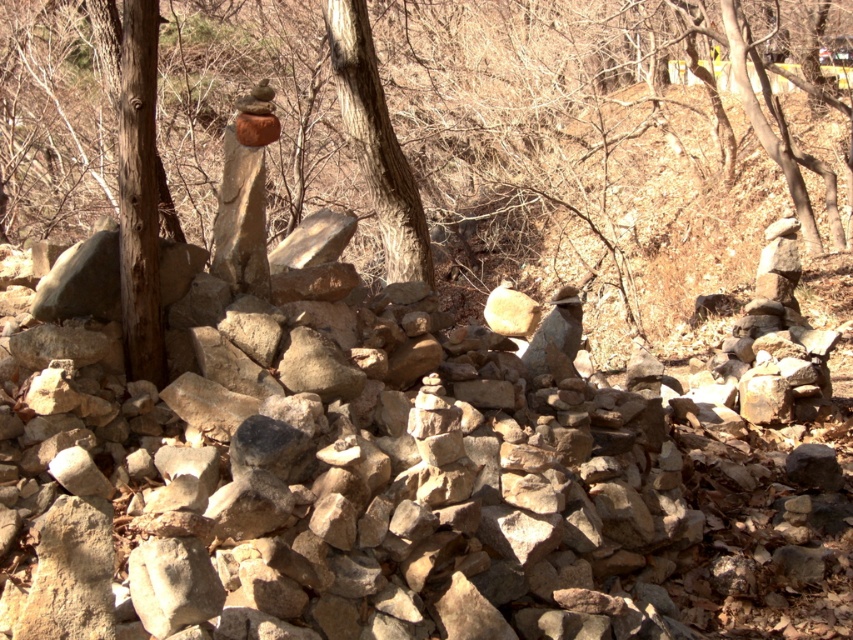
Question: Which point appears closest to the camera in this image?

Choices:
 (A) (399, 193)
 (B) (144, 337)
 (C) (305, 12)

Answer: (B)

Question: Considering the relative positions of smooth brown tree trunk at left and brown rough wood at left in the image provided, where is smooth brown tree trunk at left located with respect to brown rough wood at left?

Choices:
 (A) below
 (B) above

Answer: (B)

Question: Can you confirm if brown rough wood at left is bigger than smooth brown bark at center?

Choices:
 (A) yes
 (B) no

Answer: (B)

Question: Does smooth brown tree trunk at left have a smaller size compared to brown rough wood at left?

Choices:
 (A) yes
 (B) no

Answer: (B)

Question: Which object is the closest to the brown rough wood at left?

Choices:
 (A) smooth brown bark at center
 (B) smooth brown tree trunk at left

Answer: (A)

Question: Which object is farther from the camera taking this photo?

Choices:
 (A) smooth brown bark at center
 (B) brown rough wood at left

Answer: (A)